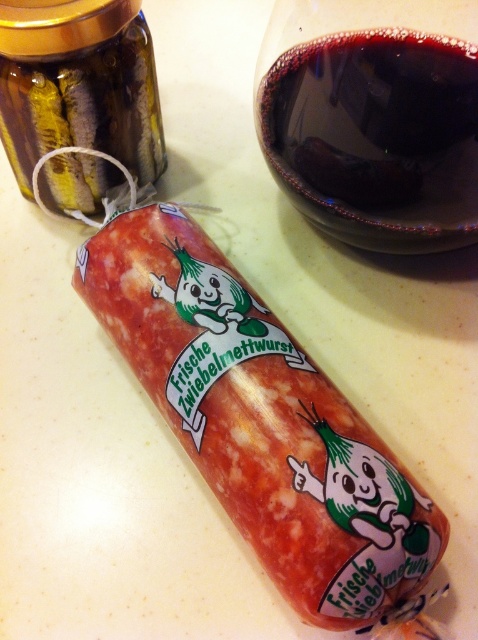
Who is more forward, [324,387] or [475,83]?

Point [475,83] is in front.

Is matte pinkish-red sausage at center closer to the viewer compared to dark red glass at upper right?

Yes, it is.

Who is more distant from viewer, (401, 586) or (257, 122)?

Point (257, 122)

Identify the location of matte pinkish-red sausage at center. Image resolution: width=478 pixels, height=640 pixels. (261, 422).

Does dark red glass at upper right have a lesser height compared to translucent amber glass jar at upper left?

No.

Is point (448, 106) positioned before point (46, 77)?

That is True.

Find the location of a particular element. dark red glass at upper right is located at coordinates (378, 132).

Is matte pinkish-red sausage at center bigger than translucent amber glass jar at upper left?

Correct, matte pinkish-red sausage at center is larger in size than translucent amber glass jar at upper left.

Is point (264, 378) closer to viewer compared to point (45, 120)?

Yes, it is in front of point (45, 120).

Where is `matte pinkish-red sausage at center`? This screenshot has height=640, width=478. matte pinkish-red sausage at center is located at coordinates (261, 422).

The image size is (478, 640). In order to click on matte pinkish-red sausage at center in this screenshot , I will do `click(261, 422)`.